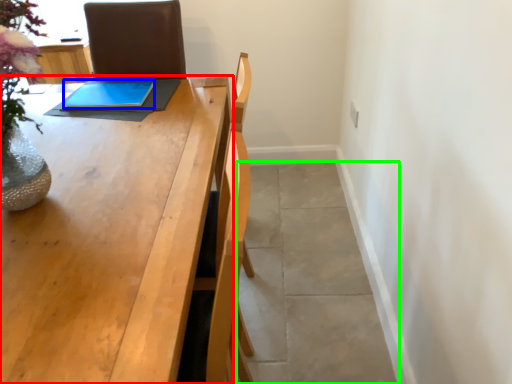
Question: Estimate the real-world distances between objects in this image. Which object is closer to table (highlighted by a red box), tablet computer (highlighted by a blue box) or concrete (highlighted by a green box)?

Choices:
 (A) tablet computer
 (B) concrete

Answer: (A)